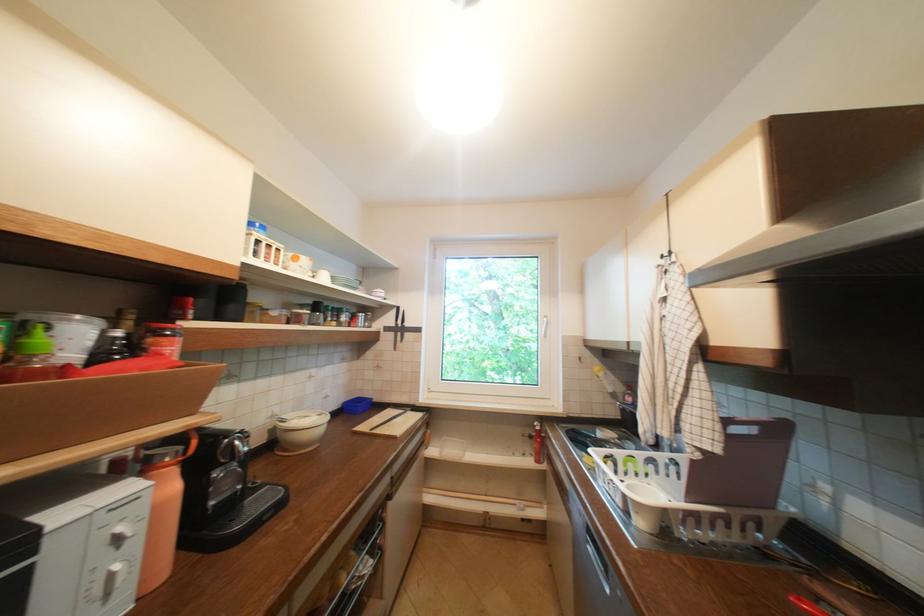
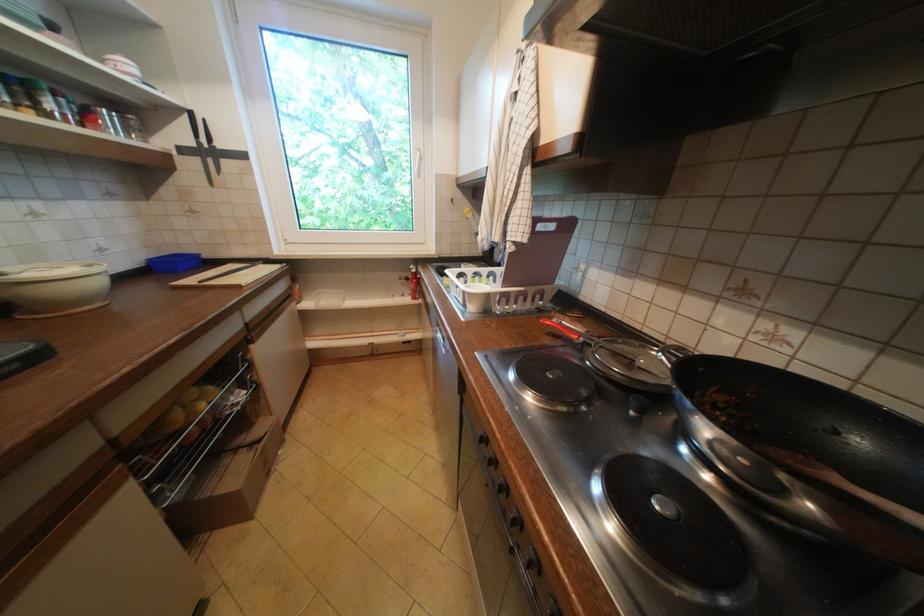
Where in the second image is the point corresponding to point (532, 456) from the first image?

(410, 296)